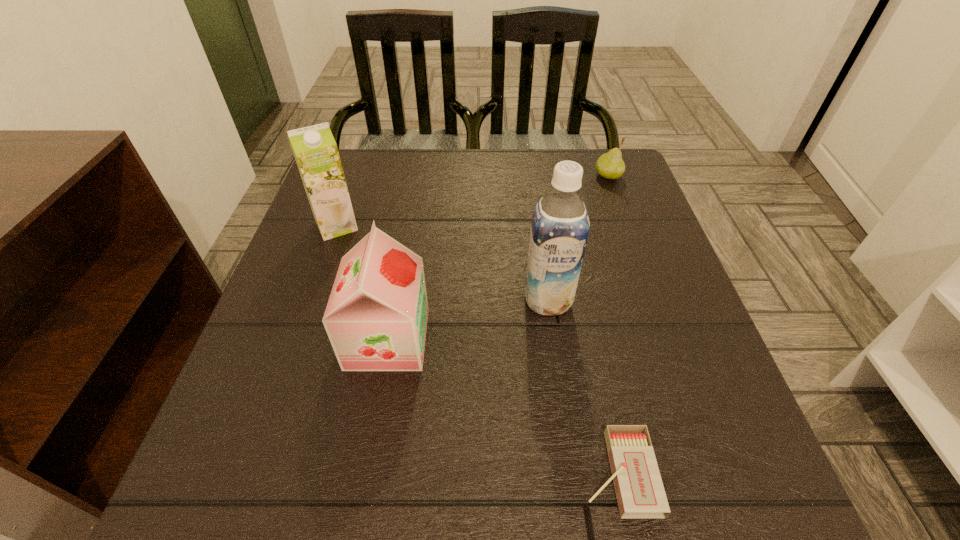
Identify the location of the tallest object. (560, 225).

Find the location of a particular element. Image resolution: width=960 pixels, height=540 pixels. the tallest soya milk is located at coordinates (560, 225).

Where is `the leftmost object`? This screenshot has height=540, width=960. the leftmost object is located at coordinates (315, 150).

At what (x,y) coordinates should I click in order to perform the action: click on the farthest soya milk. Please return your answer as a coordinate pair (x, y). This screenshot has width=960, height=540. Looking at the image, I should click on (315, 150).

Locate an element on the screen. This screenshot has width=960, height=540. the second object from left to right is located at coordinates (376, 317).

Where is `the rightmost object`? This screenshot has height=540, width=960. the rightmost object is located at coordinates (610, 165).

Image resolution: width=960 pixels, height=540 pixels. I want to click on pear, so click(610, 165).

I want to click on the shortest object, so click(640, 493).

I want to click on the nearest object, so click(x=640, y=493).

In order to click on free space located on the label of the tallest soya milk in this screenshot , I will do `click(558, 374)`.